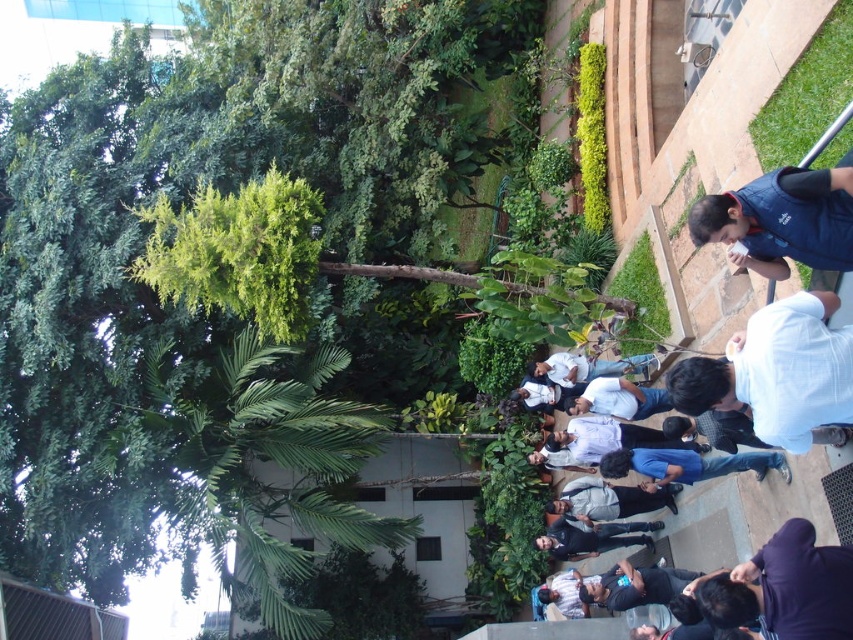
From the picture: You are standing on the paved walkway in the garden scene. You see two shirts at the lower right corner of your view. Which shirt is positioned more to the right between the white cotton shirt at lower right and the dark blue shirt at lower right?

The white cotton shirt at lower right is positioned more to the right than the dark blue shirt at lower right according to the description.

You are a photographer adjusting your camera settings to focus on the white cotton shirt at lower right and the blue denim jeans at lower center. Which object should you adjust your focus to first if you want to capture both in the same frame, considering their sizes?

The white cotton shirt at lower right has a smaller size compared to blue denim jeans at lower center, so you should focus on the blue denim jeans at lower center first to ensure it is in sharp focus before adjusting for the smaller white cotton shirt at lower right.

You are a photographer standing at the edge of the garden. You want to take a photo that includes both the blue fleece vest at upper right and the dark blue shirt at center. Considering the distance between them, is it possible to capture both in a single frame without moving your position?

The blue fleece vest at upper right and dark blue shirt at center are 28.07 feet apart from each other. Depending on the camera lens, it might be challenging to capture both in a single frame without moving, as 28 feet is a relatively large distance. A wide angle lens could potentially include both, but a standard lens might require adjusting the framing.